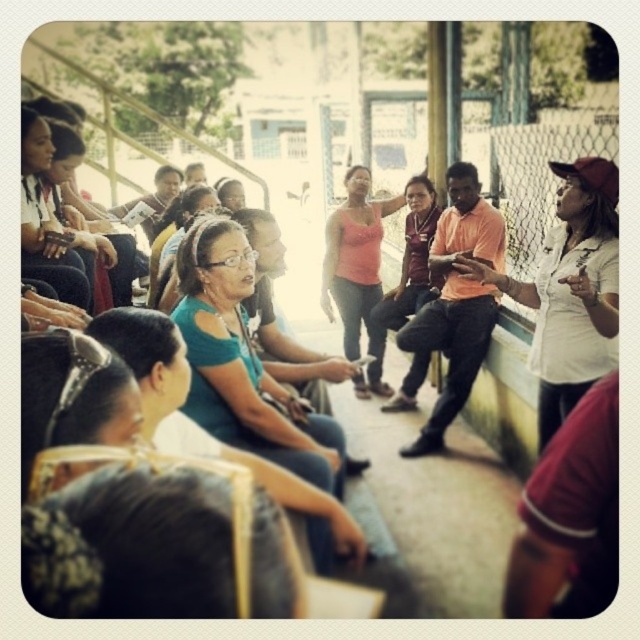
You are a photographer trying to capture a photo of the pink matte tank top at center and the matte black laptop at left. Based on their heights, which object should you focus on first to ensure both are in frame?

The pink matte tank top at center is much taller than the matte black laptop at left, so you should focus on the pink matte tank top at center first to ensure both are in frame.

Looking at this image, you are organizing a community event and need to arrange seating based on the attendees clothing. You have two people in the scene, one wearing a white matte shirt at right and another in a teal fabric shirt at center. Which attendee should you seat in a larger chair to accommodate their clothing size?

The white matte shirt at right has a larger size compared to the teal fabric shirt at center, so you should seat the attendee wearing the white matte shirt at right in the larger chair.

Consider the image. You are a photographer trying to capture a candid shot of the group. You want to ensure that both the white matte shirt at right and the teal fabric shirt at center are in focus. Given that your camera has a depth of field that can sharply focus on objects within a 5 feet range, will both subjects be in focus?

The white matte shirt at right and teal fabric shirt at center are 4.75 feet apart. Since the distance between them is within the 5 feet range of the camera, both subjects will be in focus.